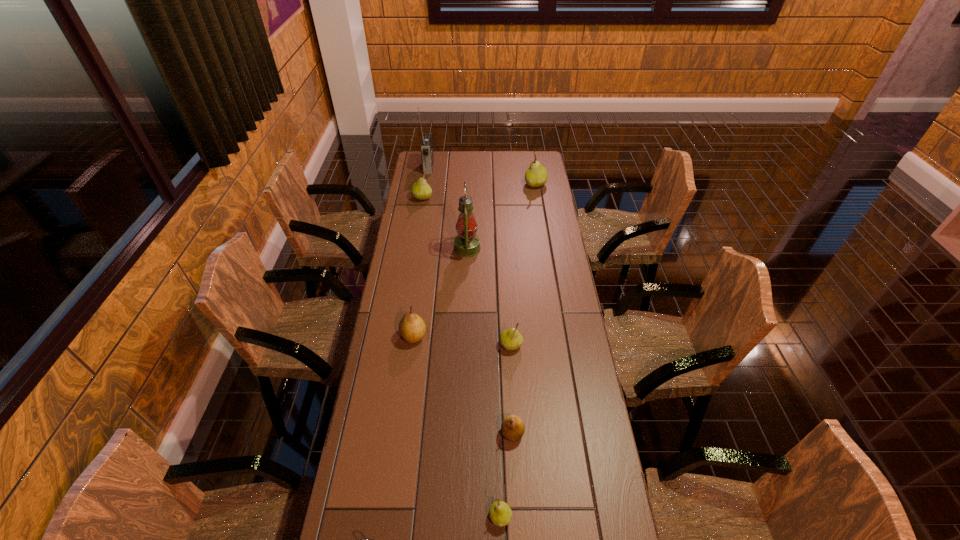
You are a GUI agent. You are given a task and a screenshot of the screen. Output one action in this format:
    pyautogui.click(x=<x>, y=<y>)
    Task: Click on the free space between the second nearest green pear and the farther brown pear
    
    Given the screenshot: What is the action you would take?
    (462, 341)

Image resolution: width=960 pixels, height=540 pixels. I want to click on free space between the third farthest object and the oil lamp, so click(x=444, y=223).

What are the coordinates of `vacant area that lies between the smallest green pear and the oil lamp` in the screenshot? It's located at (484, 383).

The width and height of the screenshot is (960, 540). I want to click on free spot between the farther brown pear and the second nearest pear, so click(463, 384).

Image resolution: width=960 pixels, height=540 pixels. Find the location of `blank region between the farthest green pear and the fifth object from right to left`. blank region between the farthest green pear and the fifth object from right to left is located at coordinates (501, 217).

I want to click on free space between the fifth object from right to left and the third smallest green pear, so click(x=444, y=223).

Identify which object is the second closest to the oil lamp. Please provide its 2D coordinates. Your answer should be formatted as a tuple, i.e. [(x, y)], where the tuple contains the x and y coordinates of a point satisfying the conditions above.

[(412, 328)]

Identify which object is the third closest to the third biggest green pear. Please provide its 2D coordinates. Your answer should be formatted as a tuple, i.e. [(x, y)], where the tuple contains the x and y coordinates of a point satisfying the conditions above.

[(466, 244)]

Where is `pear that is the nearest to the sixth nearest object`? Image resolution: width=960 pixels, height=540 pixels. pear that is the nearest to the sixth nearest object is located at coordinates (421, 190).

Locate which pear is the sixth closest to the radio receiver. Please provide its 2D coordinates. Your answer should be formatted as a tuple, i.e. [(x, y)], where the tuple contains the x and y coordinates of a point satisfying the conditions above.

[(500, 513)]